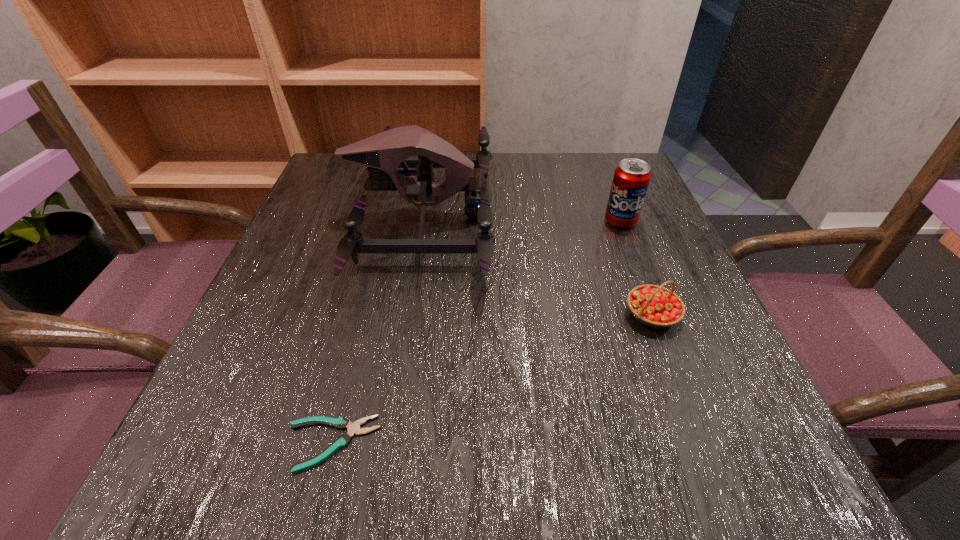
Find the location of a particular element. empty space between the strawberry and the tallest object is located at coordinates (537, 266).

Locate an element on the screen. The width and height of the screenshot is (960, 540). unoccupied area between the drone and the third tallest object is located at coordinates (537, 266).

At what (x,y) coordinates should I click in order to perform the action: click on free space between the drone and the second shortest object. Please return your answer as a coordinate pair (x, y). Looking at the image, I should click on (537, 266).

Where is `the closest object to the drone`? This screenshot has width=960, height=540. the closest object to the drone is located at coordinates (342, 441).

Choose which object is the second nearest neighbor to the soda can. Please provide its 2D coordinates. Your answer should be formatted as a tuple, i.e. [(x, y)], where the tuple contains the x and y coordinates of a point satisfying the conditions above.

[(383, 153)]

Image resolution: width=960 pixels, height=540 pixels. I want to click on vacant space that satisfies the following two spatial constraints: 1. on the back side of the strawberry; 2. on the right side of the soda can, so click(616, 221).

Identify the location of vacant space that satisfies the following two spatial constraints: 1. on the front-facing side of the tallest object; 2. on the right side of the strawberry. This screenshot has height=540, width=960. (405, 315).

Identify the location of free space that satisfies the following two spatial constraints: 1. on the front-facing side of the drone; 2. on the left side of the soda can. This screenshot has width=960, height=540. (421, 221).

Locate an element on the screen. The width and height of the screenshot is (960, 540). blank space that satisfies the following two spatial constraints: 1. on the front-facing side of the strawberry; 2. on the left side of the tallest object is located at coordinates (405, 315).

Find the location of a particular element. vacant space that satisfies the following two spatial constraints: 1. on the back side of the third shortest object; 2. on the front-facing side of the tallest object is located at coordinates (619, 218).